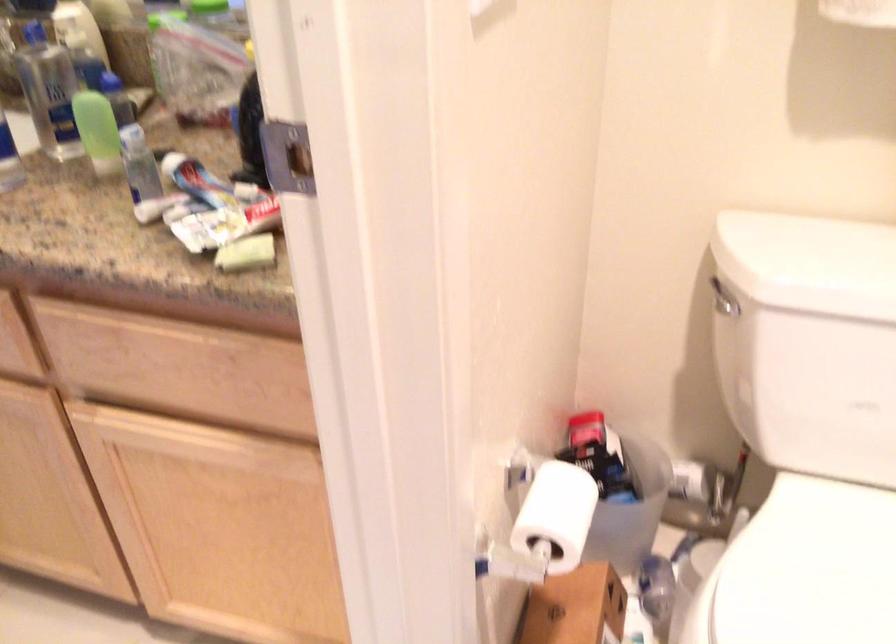
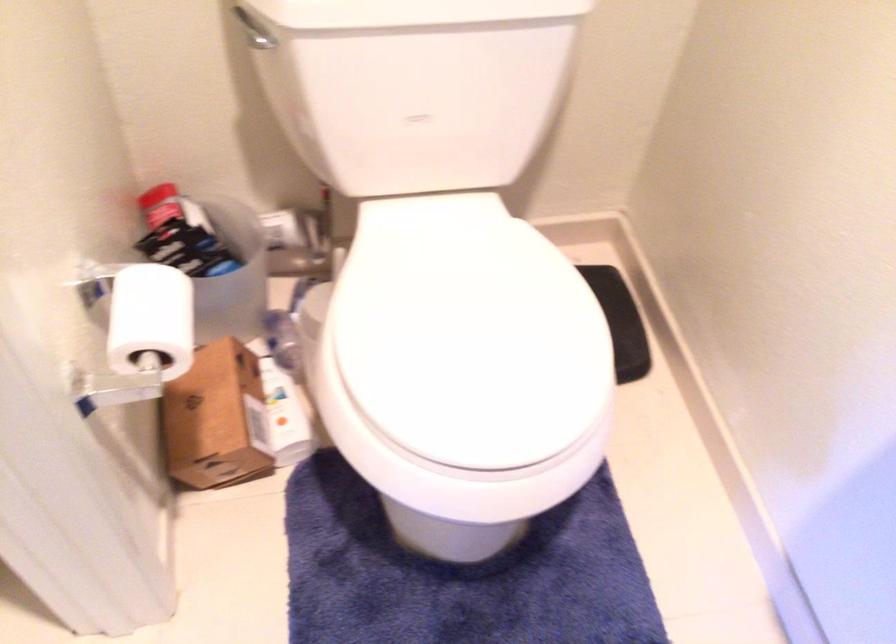
The point at (x=582, y=426) is marked in the first image. Where is the corresponding point in the second image?

(159, 205)